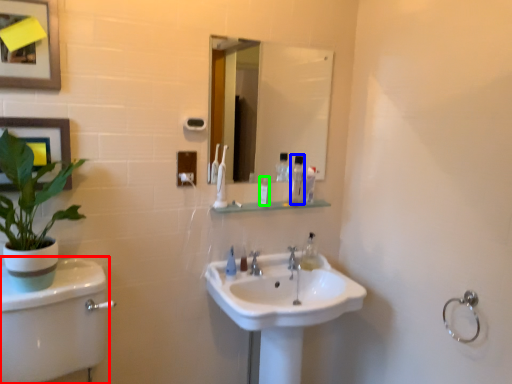
Question: Which object is the closest to the plain (highlighted by a red box)? Choose among these: mouthwash (highlighted by a blue box) or toiletry (highlighted by a green box).

Choices:
 (A) mouthwash
 (B) toiletry

Answer: (B)